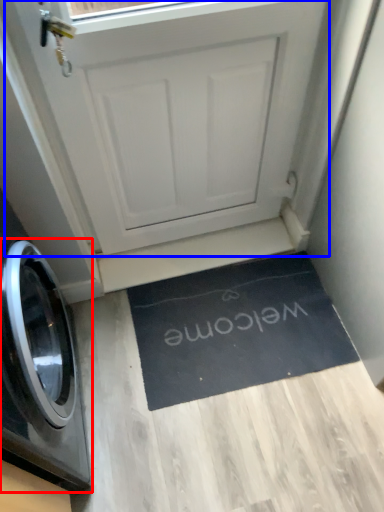
Question: Which object appears closest to the camera in this image, washing machine (highlighted by a red box) or screen door (highlighted by a blue box)?

Choices:
 (A) washing machine
 (B) screen door

Answer: (A)